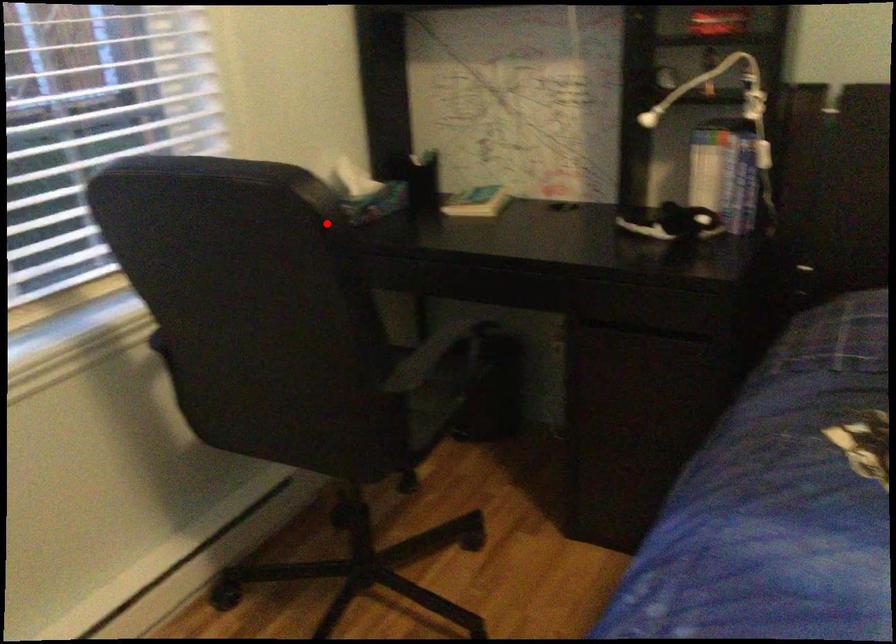
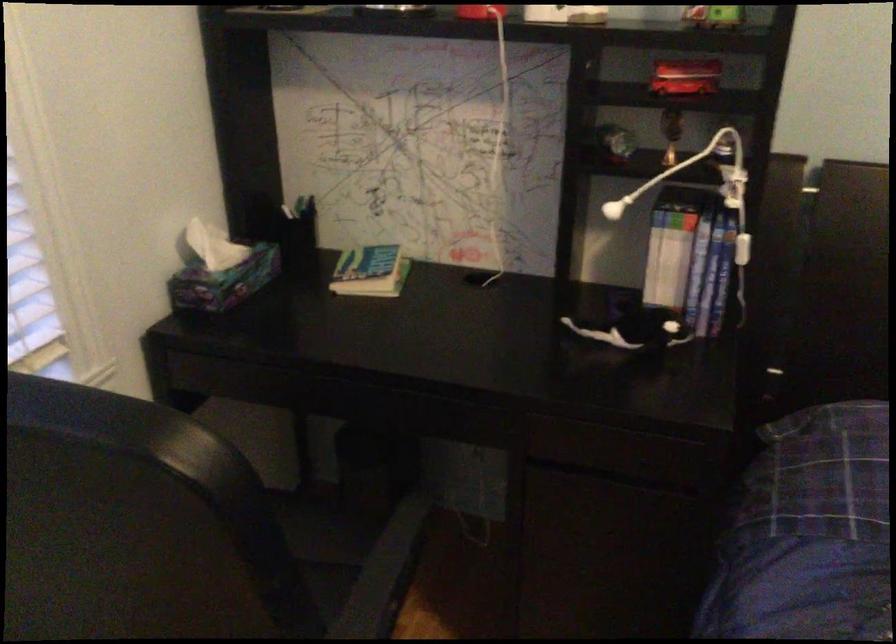
Question: I am providing you with two images of the same scene from different viewpoints. A red point is shown in image1. For the corresponding object point in image2, is it positioned nearer or farther from the camera?

Choices:
 (A) Nearer
 (B) Farther

Answer: (A)